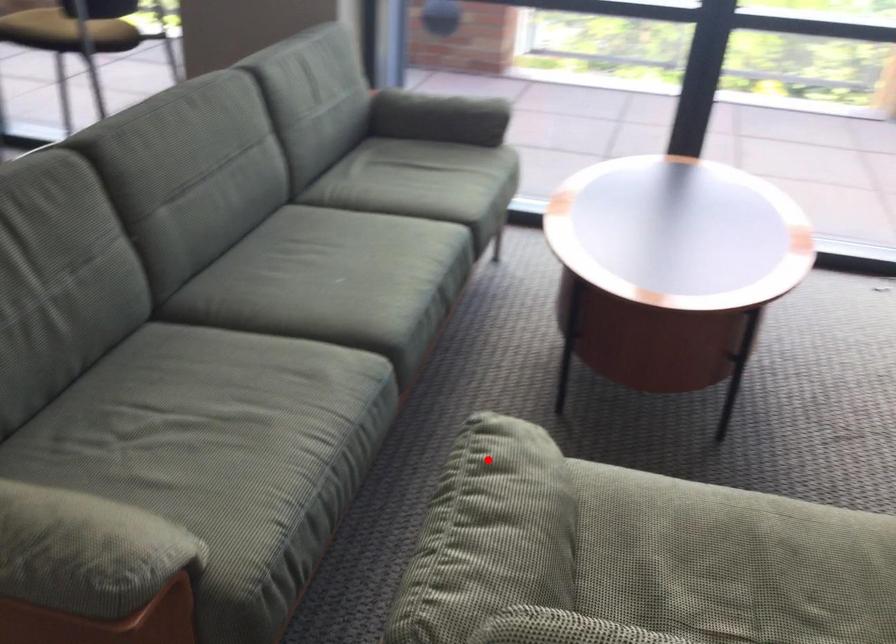
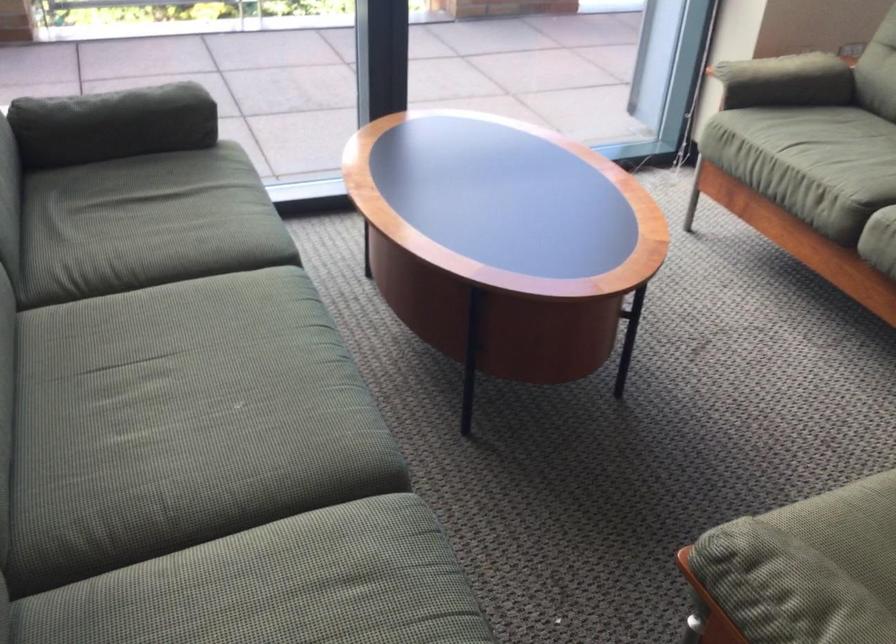
Question: A red point is marked in image1. In image2, is the corresponding 3D point closer to the camera or farther? Reply with the corresponding letter.

Choices:
 (A) The corresponding 3D point is closer.
 (B) The corresponding 3D point is farther.

Answer: (A)